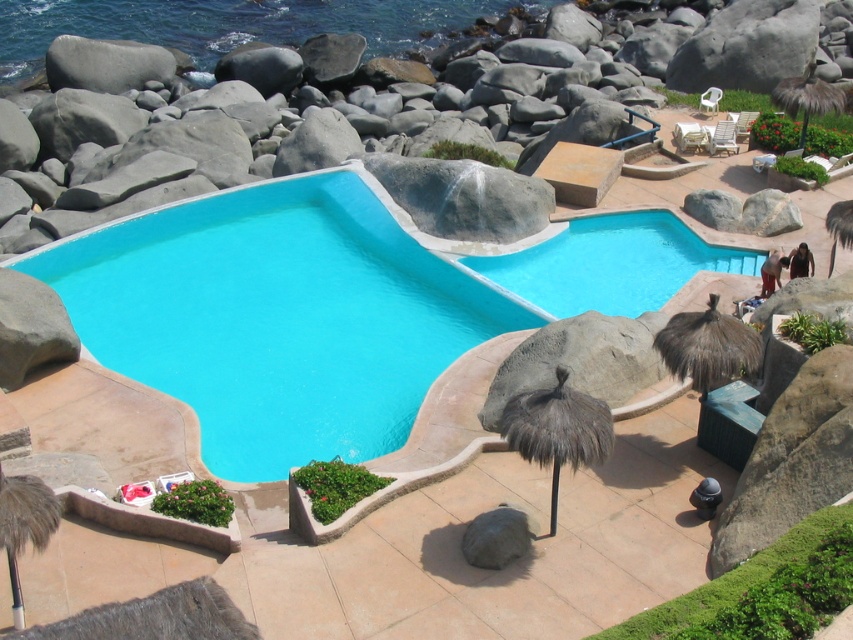
From the picture: You are designing a safety plan for the pool area. Considering the height difference between the smooth concrete pool at center and the brown thatched umbrella at upper right, which object would pose a higher risk of injury if someone were to trip over it?

The smooth concrete pool at center is taller than the brown thatched umbrella at upper right, so it would pose a higher risk of injury if someone were to trip over it.

You are a maintenance worker who needs to move the dark grey thatched umbrella at center to the brown thatched umbrella at upper right. If your wheelbarrow can carry items up to 15 meters, will you be able to transport it in one trip?

The distance between the dark grey thatched umbrella at center and the brown thatched umbrella at upper right is 14.98 meters, which is within the wheelbarrow capacity of 15 meters. Yes, you can transport it in one trip.